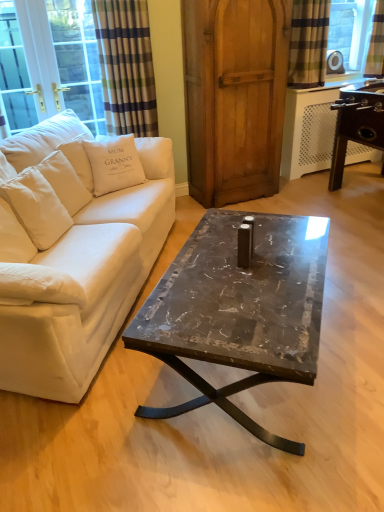
Find the location of a particular element. vacant space to the right of marble-coated coffee table at center is located at coordinates (352, 320).